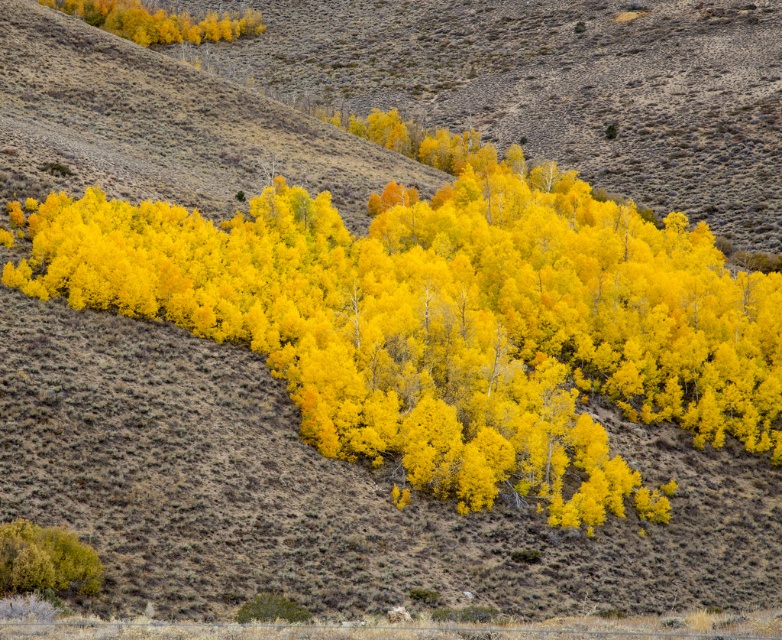
You are standing at the center of the image and want to reach the green leafy bush at lower left. Which direction should you move to reach it?

The green leafy bush at lower left is located at point coordinates, so you should move towards the lower left direction to reach it.

Based on the scene description, where are the yellow leafy trees at center located in the image?

The yellow leafy trees at center are located at point (449,320) in the image.